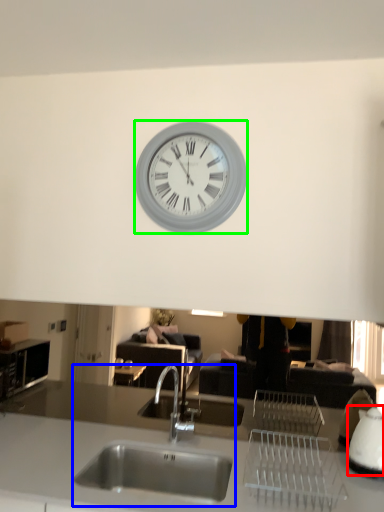
Question: Estimate the real-world distances between objects in this image. Which object is closer to appliance (highlighted by a red box), sink (highlighted by a blue box) or wall clock (highlighted by a green box)?

Choices:
 (A) sink
 (B) wall clock

Answer: (A)